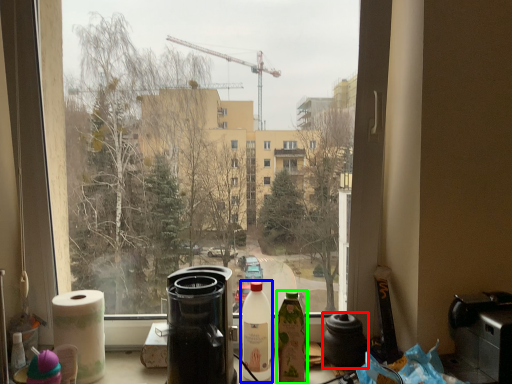
Question: Based on their relative distances, which object is nearer to coffeepot (highlighted by a red box)? Choose from bottle (highlighted by a blue box) and bottle (highlighted by a green box).

Choices:
 (A) bottle
 (B) bottle

Answer: (B)